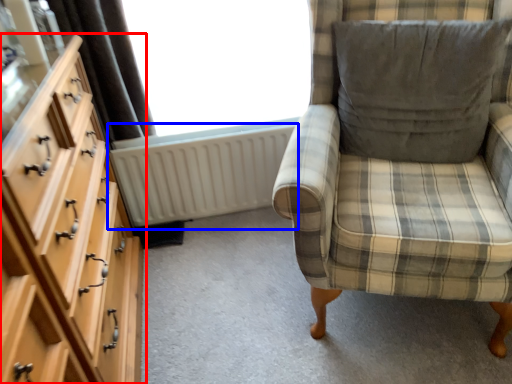
Question: Among these objects, which one is nearest to the camera, chest of drawers (highlighted by a red box) or radiator (highlighted by a blue box)?

Choices:
 (A) chest of drawers
 (B) radiator

Answer: (A)